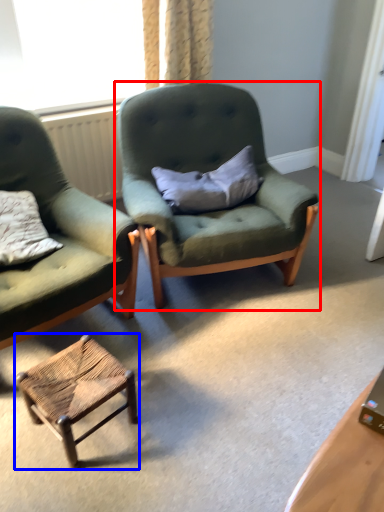
Question: Among these objects, which one is nearest to the camera, chair (highlighted by a red box) or stool (highlighted by a blue box)?

Choices:
 (A) chair
 (B) stool

Answer: (B)